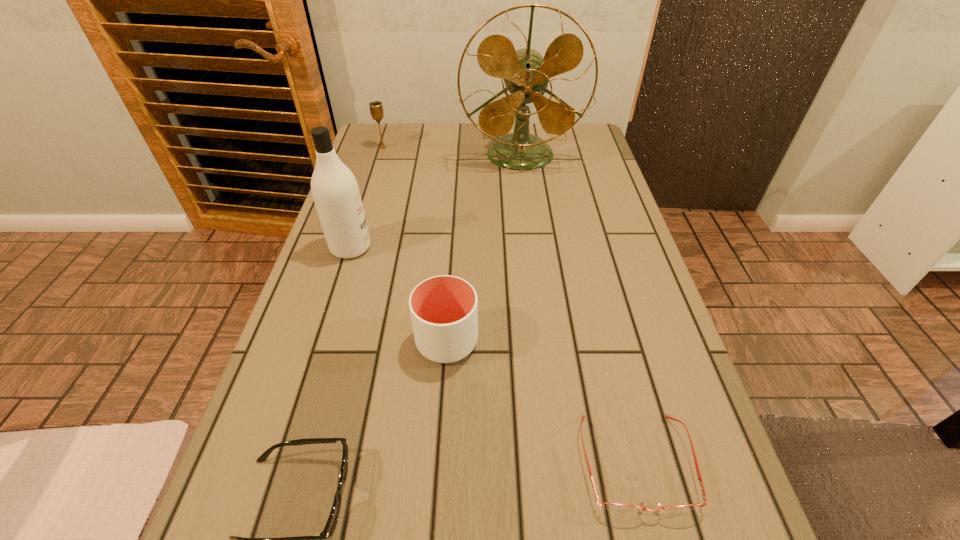
Locate an element on the screen. This screenshot has height=540, width=960. vacant space located 0.250m on the right of the chalice is located at coordinates (467, 147).

Where is `vacant region located 0.180m on the front of the cup`? The height and width of the screenshot is (540, 960). vacant region located 0.180m on the front of the cup is located at coordinates click(x=439, y=463).

In order to click on fan that is at the far edge in this screenshot , I will do `click(526, 73)`.

You are a GUI agent. You are given a task and a screenshot of the screen. Output one action in this format:
    pyautogui.click(x=<x>, y=<y>)
    Task: Click on the chalice located in the far edge section of the desktop
    
    Given the screenshot: What is the action you would take?
    pyautogui.click(x=376, y=108)

I want to click on shampoo at the left edge, so click(x=336, y=194).

This screenshot has height=540, width=960. Identify the location of chalice that is at the left edge. (376, 108).

Locate an element on the screen. The image size is (960, 540). fan that is at the right edge is located at coordinates [526, 73].

Find the location of a particular element. This screenshot has height=540, width=960. spectacles situated at the right edge is located at coordinates (616, 507).

Locate an element on the screen. The width and height of the screenshot is (960, 540). object that is at the far left corner is located at coordinates (376, 108).

You are a GUI agent. You are given a task and a screenshot of the screen. Output one action in this format:
    pyautogui.click(x=<x>, y=<y>)
    Task: Click on the object at the far right corner
    The width and height of the screenshot is (960, 540).
    Given the screenshot: What is the action you would take?
    pyautogui.click(x=526, y=73)